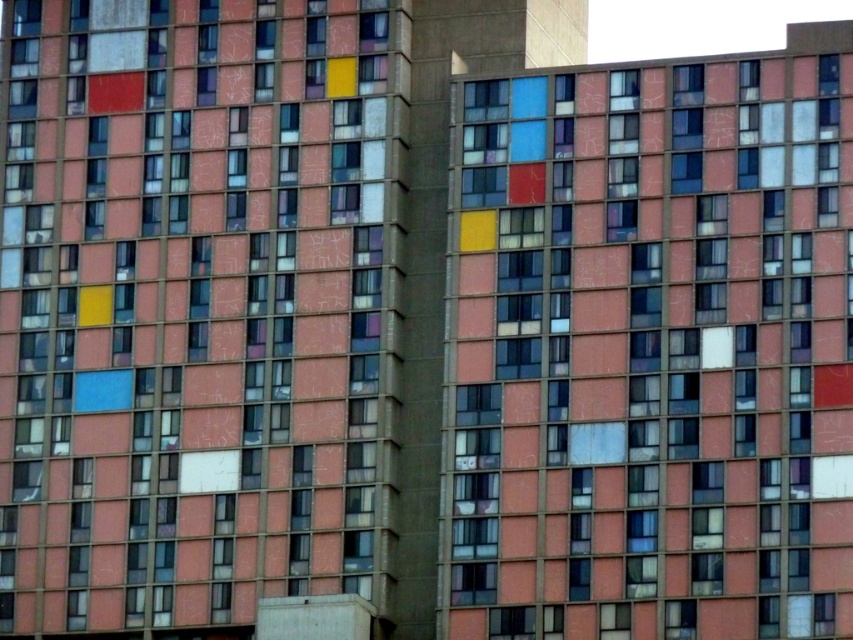
You are standing in front of a multi story residential building with a reddish brown facade. You see a point marked at coordinates (x=196, y=307). What color is the window located at this point?

The window at point (x=196, y=307) is matte pink.

You are an architect reviewing the building facade. You notice two windows at the center of the building. One is labeled as the matte pink window at center and the other as the matte glass window at center. Which of these two windows has a greater height?

The matte pink window at center is much taller than the matte glass window at center, so the matte pink window at center has a greater height.

From the picture: You are standing in front of the multi story residential building. You see a matte pink window at center and a matte glass window at center. Which one is closer to you?

The matte pink window at center is closer to you because the matte glass window at center is behind it.